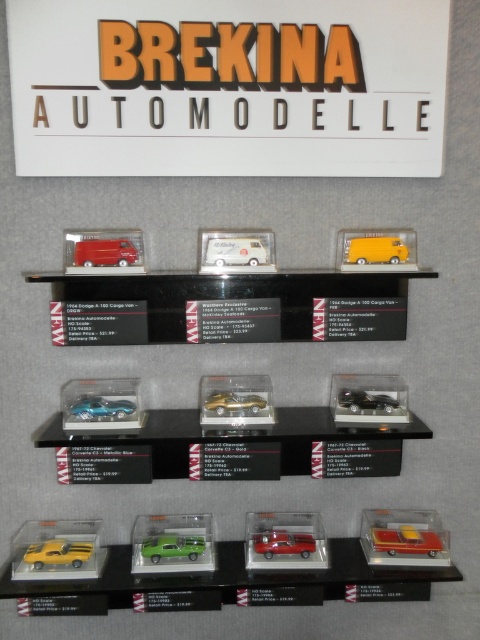
Is point (52, 557) positioned behind point (252, 394)?

No, (52, 557) is closer to viewer.

How far apart are yellow matte toy car at lower left and gold metallic sports car at center?

yellow matte toy car at lower left is 21.98 inches away from gold metallic sports car at center.

Is point (66, 554) less distant than point (249, 396)?

That is True.

Image resolution: width=480 pixels, height=640 pixels. Identify the location of yellow matte toy car at lower left. (58, 552).

Does point (71, 52) come farther from viewer compared to point (251, 388)?

No, it is in front of (251, 388).

Is point (67, 134) positioned before point (207, 400)?

Yes, it is.

Identify the location of orange plastic sign at upper center. pyautogui.click(x=228, y=86).

Identify the location of orange plastic sign at upper center. This screenshot has width=480, height=640. (228, 86).

Is point (223, 241) farther from viewer compared to point (393, 244)?

No, it is not.

Is white matte van at center closer to camera compared to matte yellow van at center?

That is True.

Who is more distant from viewer, [245,253] or [393,257]?

The point [393,257] is more distant.

This screenshot has width=480, height=640. I want to click on white matte van at center, so click(x=235, y=252).